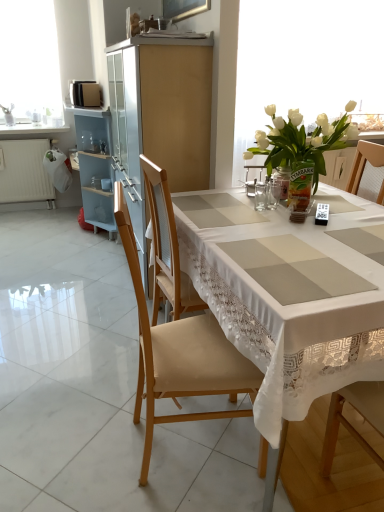
Identify the location of empty space that is ontop of white matte radiator at left (from a real-world perspective). Image resolution: width=384 pixels, height=512 pixels. (24, 136).